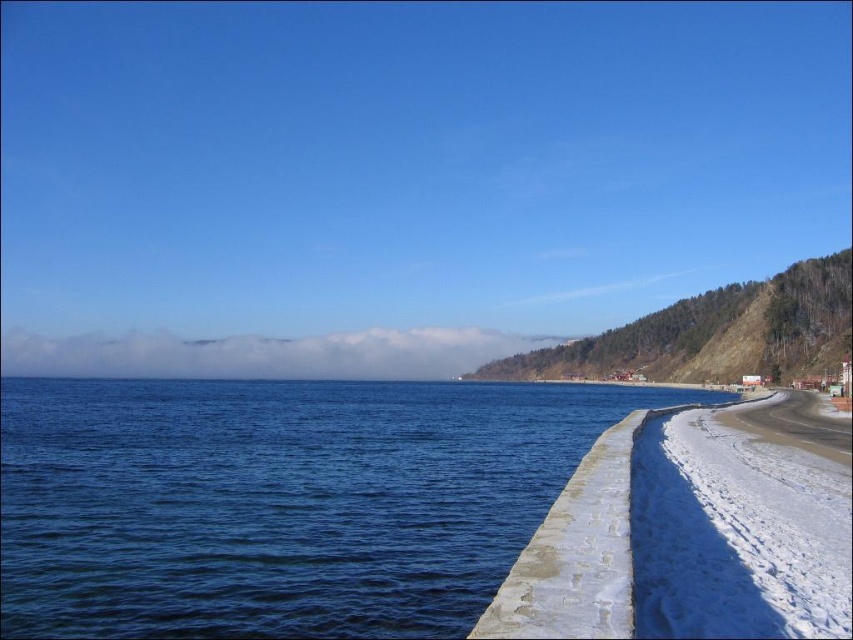
You are a photographer planning to capture the coastal scene. You have a camera with a standard lens that can focus on objects up to 5 meters away. The blue water at lower left and white snow at lower right are both within your camera frame. Can you determine which object is closer to you based on their sizes?

The blue water at lower left is larger in size than the white snow at lower right, so it appears closer to the camera since objects closer to the camera appear larger.

You are standing on the beach and want to walk from the blue water at lower left to the white snow at lower right. Based on the scene description, which direction should you head towards?

You should head towards the right direction because the white snow at lower right is located to the right side of the blue water at lower left.

From the picture: You are standing on the beach and see the blue water at lower left and the white snow at lower right. Which object is closer to the bottom edge of the image?

The blue water at lower left is positioned under white snow at lower right, so the blue water at lower water is closer to the bottom edge of the image.